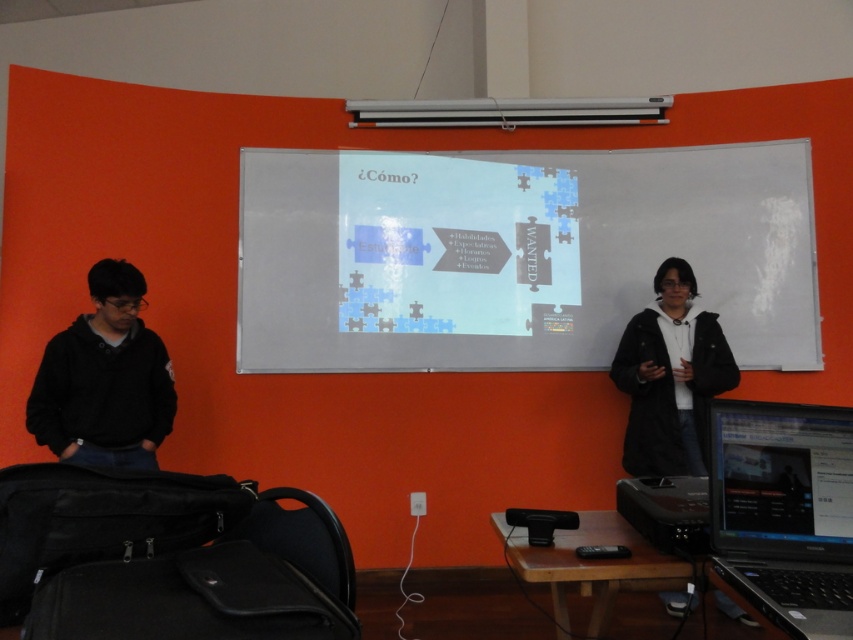
Does silver metallic laptop at lower right have a lesser width compared to black hoodie at left?

Indeed, silver metallic laptop at lower right has a lesser width compared to black hoodie at left.

Is silver metallic laptop at lower right smaller than black hoodie at left?

Indeed, silver metallic laptop at lower right has a smaller size compared to black hoodie at left.

Who is more forward, (x=827, y=532) or (x=84, y=324)?

Point (x=827, y=532) is more forward.

Find the location of a particular element. silver metallic laptop at lower right is located at coordinates (782, 513).

Can you confirm if white matte projection screen at center is shorter than black hoodie at left?

In fact, white matte projection screen at center may be taller than black hoodie at left.

Between white matte projection screen at center and black hoodie at left, which one is positioned higher?

white matte projection screen at center is higher up.

Is point (468, 163) positioned in front of point (126, 264)?

No, (468, 163) is behind (126, 264).

The image size is (853, 640). In order to click on white matte projection screen at center in this screenshot , I will do `click(515, 253)`.

Which is in front, point (457, 364) or point (634, 364)?

Positioned in front is point (634, 364).

Can you confirm if white matte projection screen at center is positioned below black matte jacket at right?

Result: No.

Is point (511, 292) farther from camera compared to point (672, 365)?

That is True.

Locate an element on the screen. The image size is (853, 640). white matte projection screen at center is located at coordinates (515, 253).